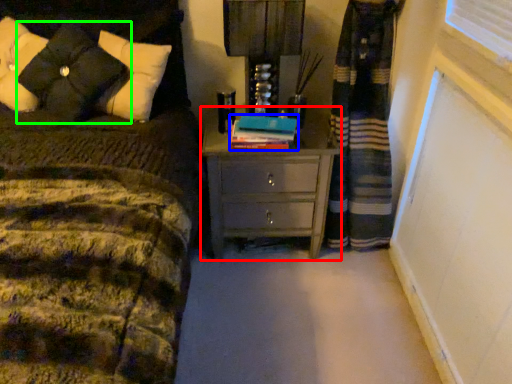
Question: Considering the real-world distances, which object is farthest from chest of drawers (highlighted by a red box)? book (highlighted by a blue box) or pillow (highlighted by a green box)?

Choices:
 (A) book
 (B) pillow

Answer: (B)